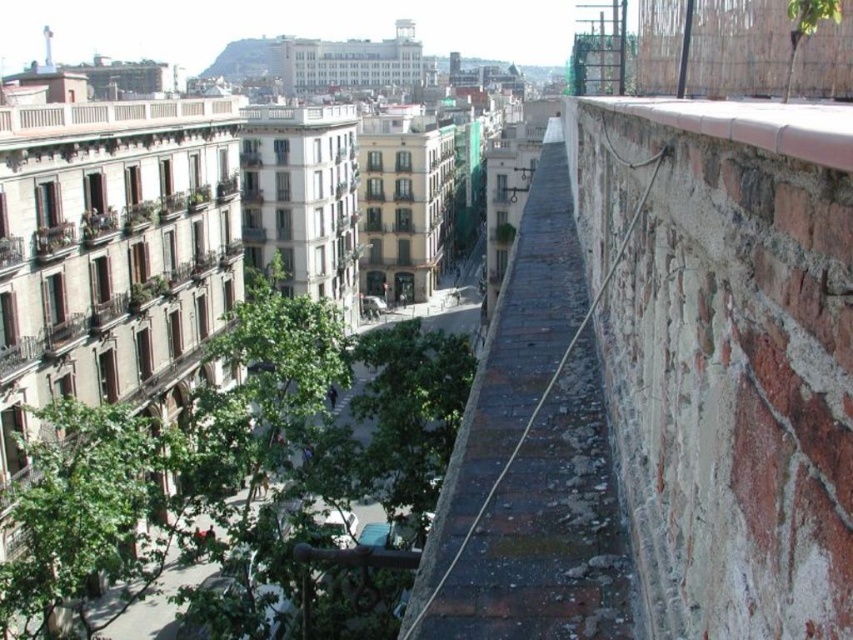
Question: Considering the real-world distances, which object is farthest from the green leafy tree at center?

Choices:
 (A) smooth concrete ledge at upper right
 (B) brick wall at right

Answer: (A)

Question: Which point is farther to the camera?

Choices:
 (A) (830, 148)
 (B) (323, 435)

Answer: (B)

Question: Can you confirm if green leafy tree at center is wider than smooth concrete ledge at upper right?

Choices:
 (A) no
 (B) yes

Answer: (B)

Question: Does green leafy tree at center appear over smooth concrete ledge at upper right?

Choices:
 (A) yes
 (B) no

Answer: (B)

Question: Is brick wall at right below smooth concrete ledge at upper right?

Choices:
 (A) yes
 (B) no

Answer: (B)

Question: Which of these objects is positioned farthest from the smooth concrete ledge at upper right?

Choices:
 (A) brick wall at right
 (B) green leafy tree at center

Answer: (B)